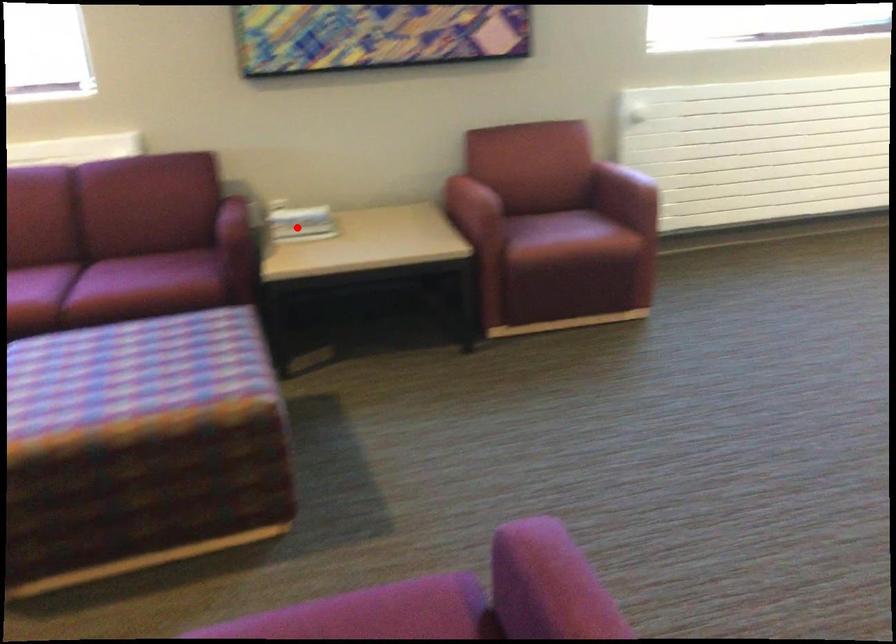
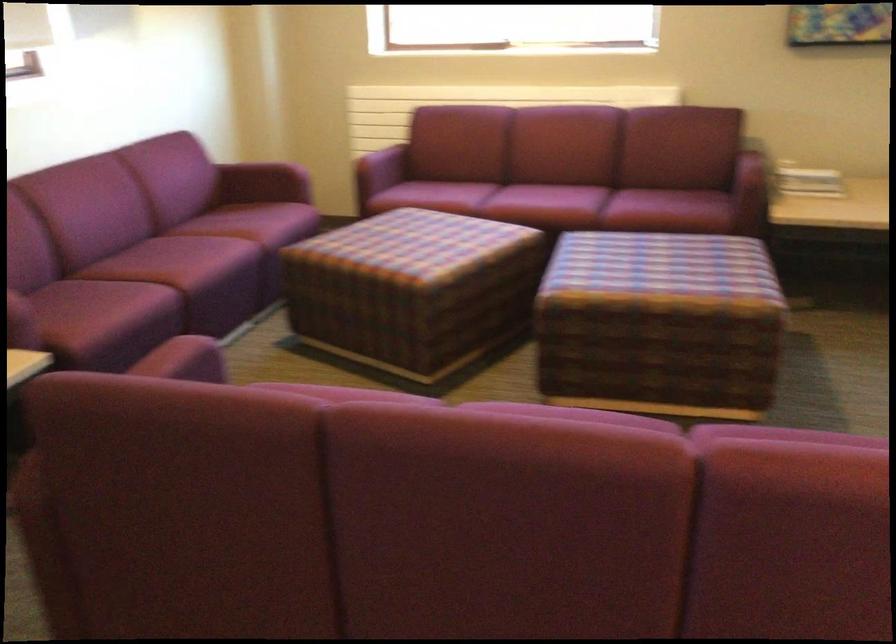
Locate, in the second image, the point that corresponds to the highlighted location in the first image.

(807, 180)